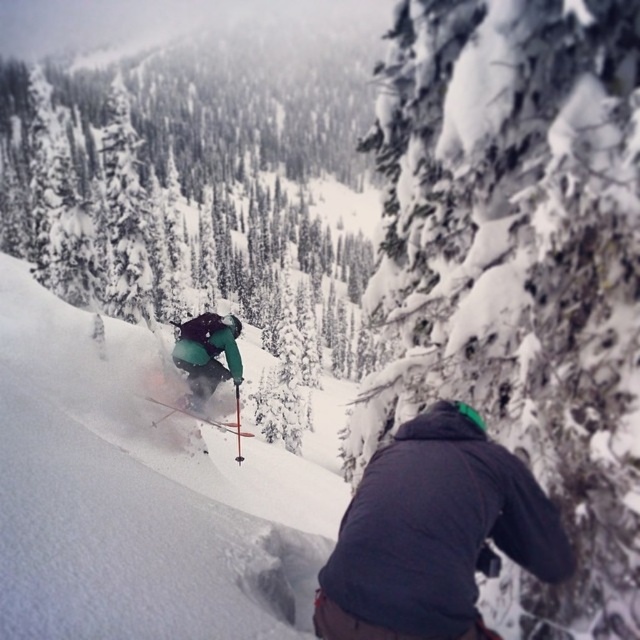
Does snowy bark tree at center appear over green matte tree at center?

No, snowy bark tree at center is not above green matte tree at center.

Does snowy bark tree at center have a greater height compared to green matte tree at center?

No.

Identify the location of snowy bark tree at center. (518, 269).

Who is positioned more to the right, snowy bark tree at center or green matte jacket at center?

From the viewer's perspective, snowy bark tree at center appears more on the right side.

From the picture: Who is more distant from viewer, (461, 83) or (182, 369)?

The point (182, 369) is more distant.

This screenshot has height=640, width=640. What do you see at coordinates (518, 269) in the screenshot?
I see `snowy bark tree at center` at bounding box center [518, 269].

Identify the location of snowy bark tree at center. (518, 269).

Looking at this image, does snowy bark tree at center come behind powder snow ski slope at center?

Yes, it is behind powder snow ski slope at center.

Is snowy bark tree at center taller than powder snow ski slope at center?

No, snowy bark tree at center is not taller than powder snow ski slope at center.

Identify the location of snowy bark tree at center. (518, 269).